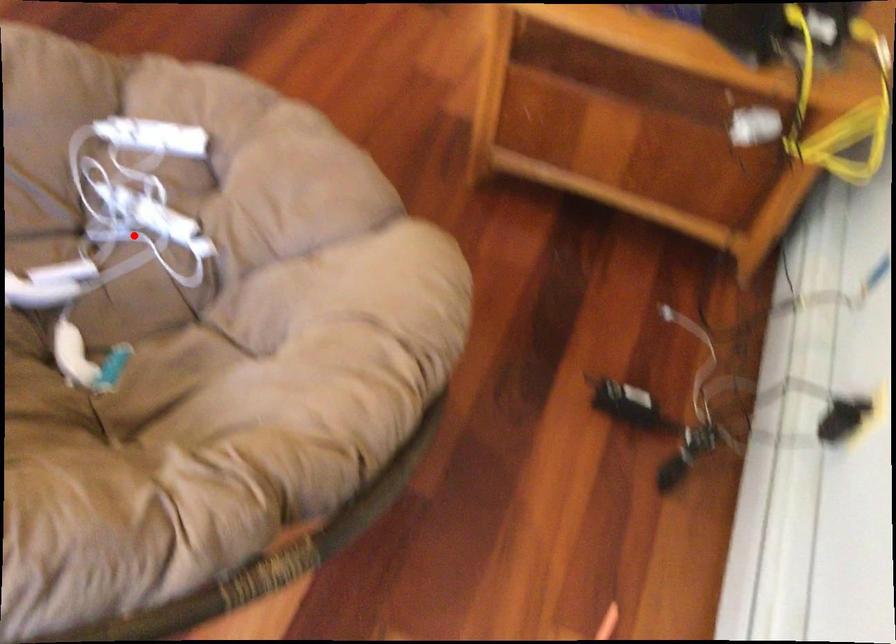
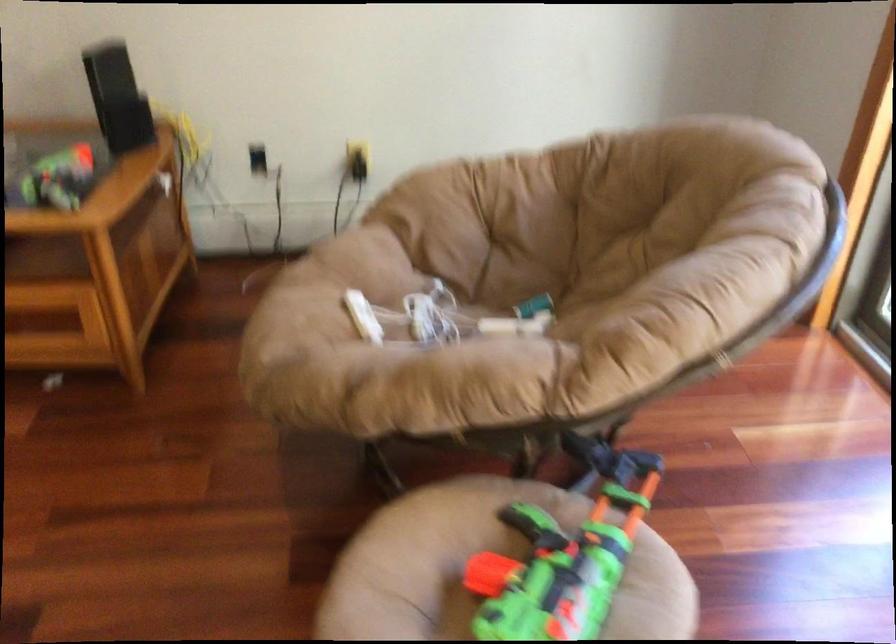
Question: I am providing you with two images of the same scene from different viewpoints. Given a red point in image1, look at the same physical point in image2. Is it:

Choices:
 (A) Closer to the viewpoint
 (B) Farther from the viewpoint

Answer: (B)